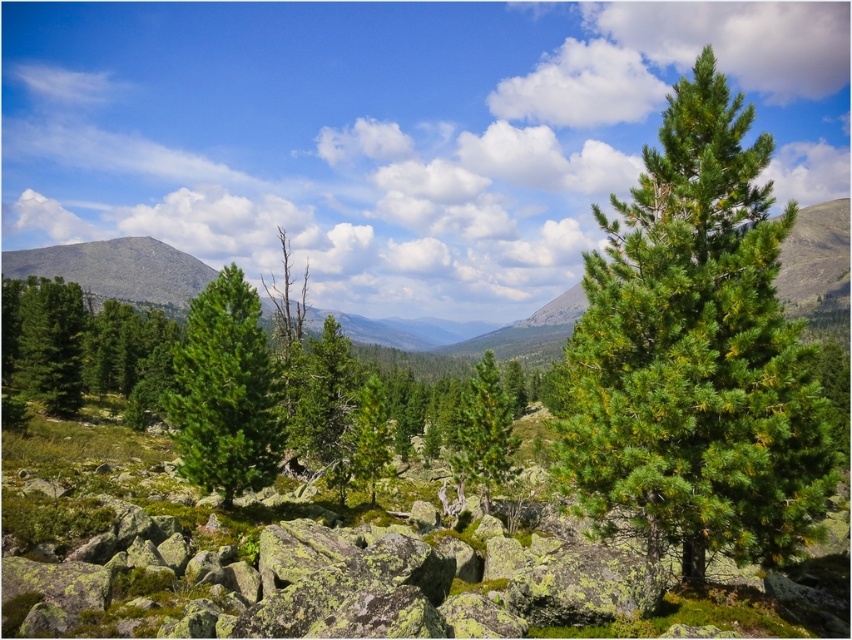
You are a hiker standing at the base of the green matte tree at left and want to reach the green matte tree at center. Which direction should you walk to get closer to your destination?

The green matte tree at center is shorter than the green matte tree at left. Since you are at the base of the green matte tree at left, you should walk towards the direction where the trees become shorter to reach the green matte tree at center.

You are standing at the edge of the rugged terrain and see the green matte tree at center and the green matte tree at left. Which tree is closer to you?

The green matte tree at center is closer to you because it is in front of the green matte tree at left.